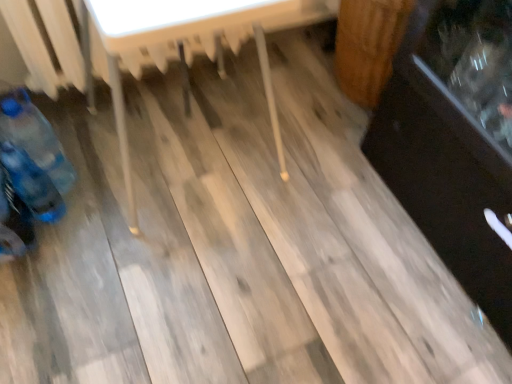
Identify the location of unoccupied region to the right of wooden table at center. This screenshot has width=512, height=384. (321, 187).